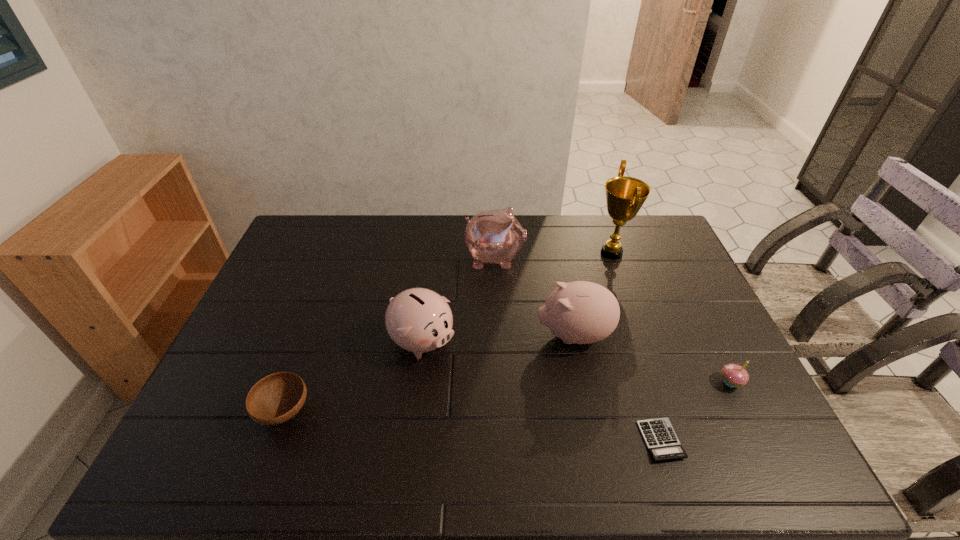
Image resolution: width=960 pixels, height=540 pixels. Find the location of `vacant area at the far left corner`. vacant area at the far left corner is located at coordinates (309, 230).

In the image, there is a desktop. Identify the location of vacant area at the near left corner. This screenshot has width=960, height=540. (229, 476).

Identify the location of vacant space at the far right corner. This screenshot has width=960, height=540. (654, 220).

Where is `vacant point located between the award and the farthest piggy bank`? Image resolution: width=960 pixels, height=540 pixels. vacant point located between the award and the farthest piggy bank is located at coordinates (553, 255).

Locate an element on the screen. unoccupied area between the second piggy bank from right to left and the calculator is located at coordinates (578, 349).

Identify the location of free area in between the calculator and the rightmost piggy bank. (617, 388).

This screenshot has width=960, height=540. In order to click on free space that is in between the shortest object and the farthest piggy bank in this screenshot , I will do `click(578, 349)`.

You are a GUI agent. You are given a task and a screenshot of the screen. Output one action in this format:
    pyautogui.click(x=<x>, y=<y>)
    Task: Click on the free space between the leftmost object and the calculator
    The image size is (960, 540).
    Given the screenshot: What is the action you would take?
    pyautogui.click(x=472, y=426)

Locate an element on the screen. unoccupied position between the fifth tallest object and the rightmost piggy bank is located at coordinates (652, 359).

Where is `free space between the shortest object and the award`? The width and height of the screenshot is (960, 540). free space between the shortest object and the award is located at coordinates (636, 347).